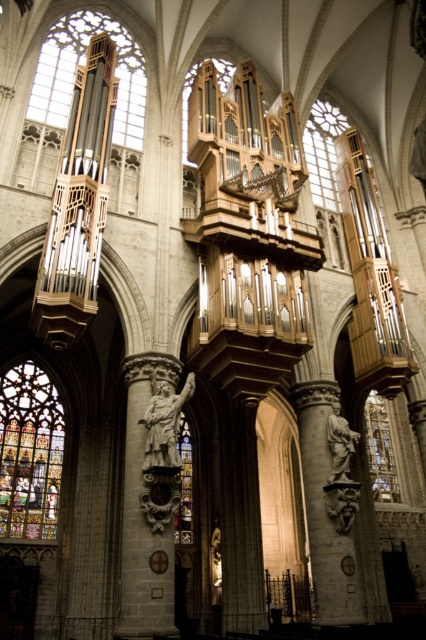
You are an interior designer planning to install a new light fixture in the cathedral. You have two options for placement locations. One is near the multicolored stained glass at lower left, and the other is near the polished bronze statue at center. Considering their sizes, which location would allow for a larger light fixture?

The multicolored stained glass at lower left is larger in size than the polished bronze statue at center, so installing a larger light fixture near the multicolored stained glass at lower left would be more appropriate.